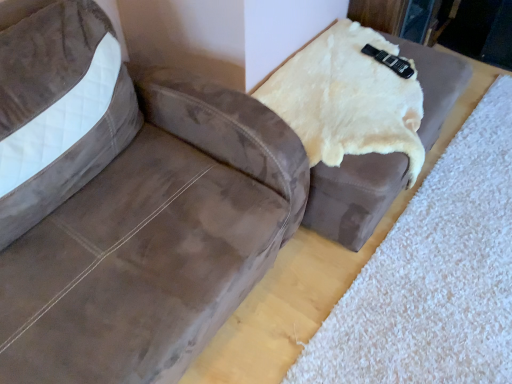
Describe the element at coordinates (434, 275) in the screenshot. I see `white fluffy cat bed at upper right` at that location.

This screenshot has height=384, width=512. In order to click on white fluffy cat bed at upper right in this screenshot , I will do `click(434, 275)`.

Identify the location of white fluffy cat bed at upper right. (434, 275).